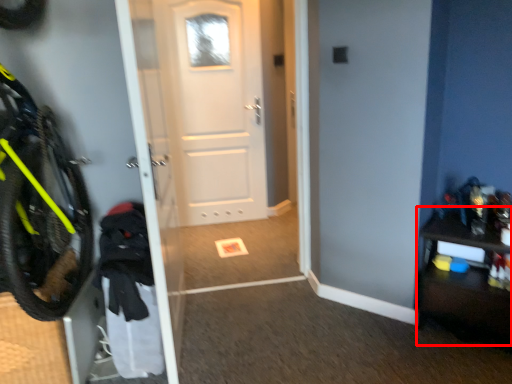
Question: From the image's perspective, what is the correct spatial relationship of dresser (annotated by the red box) in relation to door?

Choices:
 (A) above
 (B) below

Answer: (B)